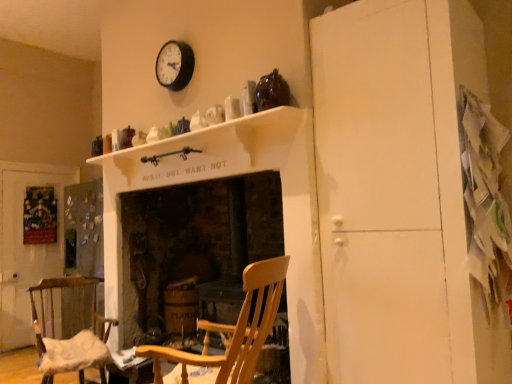
Question: Should I look upward or downward to see white matte mantle at upper center?

Choices:
 (A) down
 (B) up

Answer: (B)

Question: Does white paper at lower left have a greater width compared to wooden rocking chair at center, which is the second chair from back to front?

Choices:
 (A) no
 (B) yes

Answer: (A)

Question: Can you confirm if white paper at lower left is positioned to the right of wooden rocking chair at center, which ranks as the 1th chair in front-to-back order?

Choices:
 (A) yes
 (B) no

Answer: (B)

Question: Would you say white paper at lower left is outside wooden rocking chair at center, marked as the 2th chair in a left-to-right arrangement?

Choices:
 (A) yes
 (B) no

Answer: (A)

Question: Considering the relative sizes of white paper at lower left and wooden rocking chair at center, which is the second chair from back to front, in the image provided, is white paper at lower left smaller than wooden rocking chair at center, which is the second chair from back to front,?

Choices:
 (A) no
 (B) yes

Answer: (B)

Question: From the image's perspective, would you say white paper at lower left is positioned over wooden rocking chair at center, which ranks as the 1th chair in front-to-back order?

Choices:
 (A) no
 (B) yes

Answer: (A)

Question: Can you confirm if white paper at lower left is bigger than wooden rocking chair at center, marked as the 2th chair in a left-to-right arrangement?

Choices:
 (A) no
 (B) yes

Answer: (A)

Question: Is the position of matte black clock at upper center more distant than that of white matte cabinet at right?

Choices:
 (A) no
 (B) yes

Answer: (B)

Question: Considering the relative positions of matte black clock at upper center and white matte cabinet at right in the image provided, is matte black clock at upper center to the left of white matte cabinet at right from the viewer's perspective?

Choices:
 (A) no
 (B) yes

Answer: (B)

Question: Considering the relative positions of matte black clock at upper center and white matte cabinet at right in the image provided, is matte black clock at upper center in front of white matte cabinet at right?

Choices:
 (A) yes
 (B) no

Answer: (B)

Question: Is white matte cabinet at right located within matte black clock at upper center?

Choices:
 (A) no
 (B) yes

Answer: (A)

Question: Does matte black clock at upper center turn towards white matte cabinet at right?

Choices:
 (A) no
 (B) yes

Answer: (A)

Question: Is matte black clock at upper center in contact with white matte cabinet at right?

Choices:
 (A) no
 (B) yes

Answer: (A)

Question: Could you tell me if white paper at lower left is turned towards wooden fireplace at center?

Choices:
 (A) no
 (B) yes

Answer: (A)